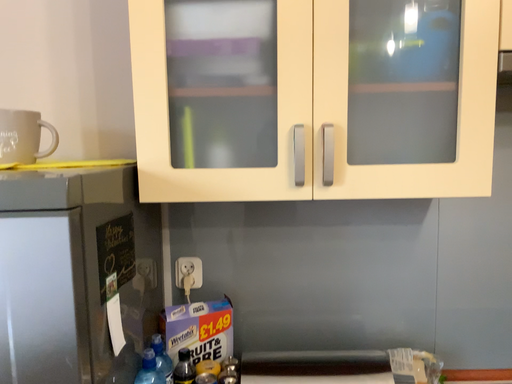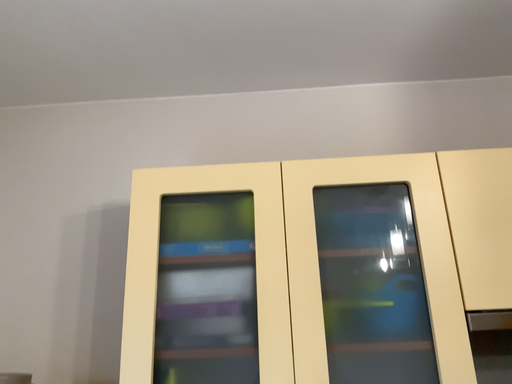
Question: Which way did the camera rotate in the video?

Choices:
 (A) rotated upward
 (B) rotated downward

Answer: (A)